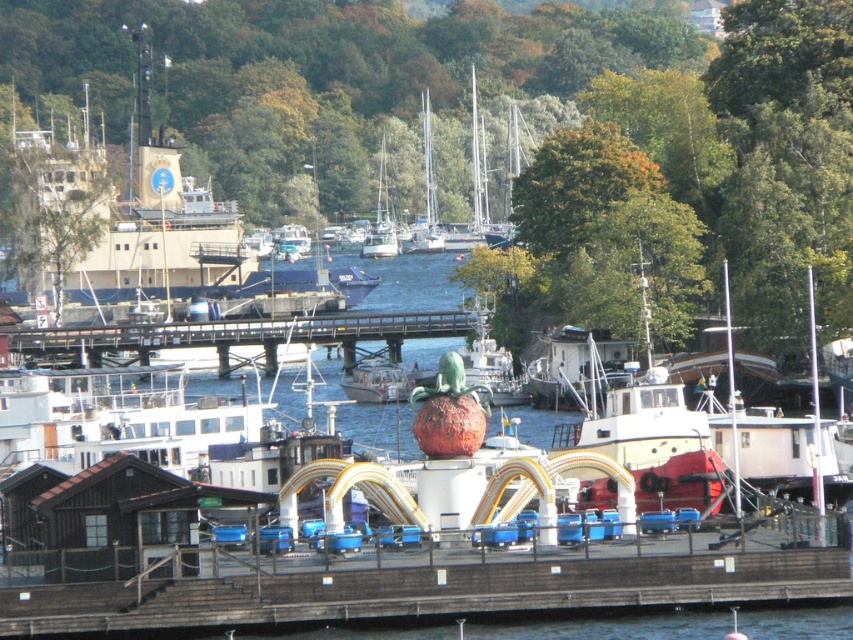
Is point (517, 573) farther from viewer compared to point (630, 470)?

No, (517, 573) is closer to viewer.

Does brown wooden dock at center have a greater height compared to red matte tugboat at center?

No, brown wooden dock at center is not taller than red matte tugboat at center.

What do you see at coordinates (427, 593) in the screenshot?
I see `brown wooden dock at center` at bounding box center [427, 593].

The width and height of the screenshot is (853, 640). I want to click on brown wooden dock at center, so click(x=427, y=593).

Which is above, brown wooden dock at center or white glossy sailboat at center?

Positioned higher is white glossy sailboat at center.

Measure the distance between brown wooden dock at center and white glossy sailboat at center.

brown wooden dock at center and white glossy sailboat at center are 352.59 meters apart from each other.

Is point (467, 582) positioned before point (373, 225)?

Yes, point (467, 582) is closer to viewer.

The image size is (853, 640). I want to click on brown wooden dock at center, so click(427, 593).

Which is below, white matte boat at right or white glossy sailboat at center?

Positioned lower is white matte boat at right.

Is white matte boat at right bigger than white glossy sailboat at center?

No.

The width and height of the screenshot is (853, 640). What do you see at coordinates (776, 440) in the screenshot?
I see `white matte boat at right` at bounding box center [776, 440].

Where is `white matte boat at right`? Image resolution: width=853 pixels, height=640 pixels. white matte boat at right is located at coordinates click(x=776, y=440).